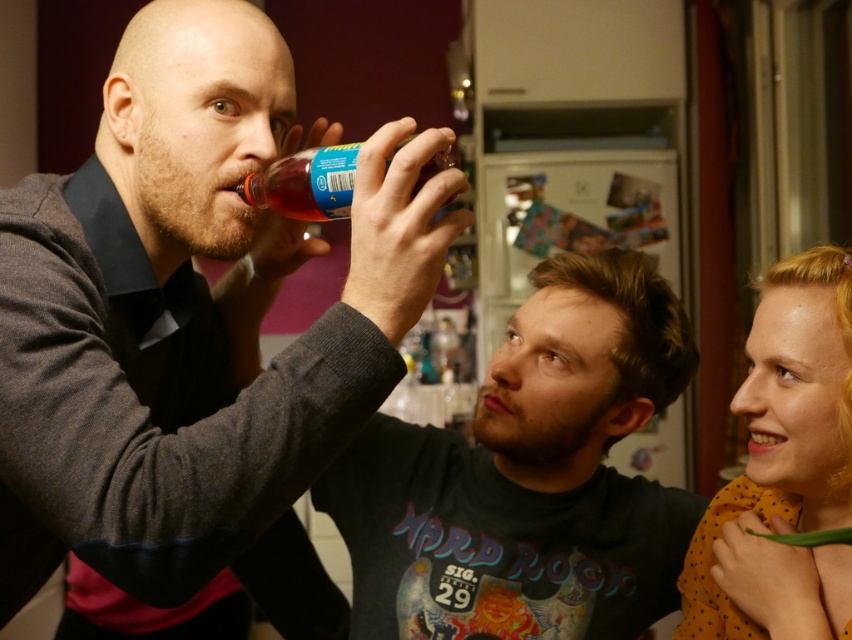
Question: Is polka dot fabric at right positioned at the back of translucent plastic bottle at upper center?

Choices:
 (A) no
 (B) yes

Answer: (B)

Question: Does polka dot fabric at right lie in front of translucent plastic bottle at upper center?

Choices:
 (A) no
 (B) yes

Answer: (A)

Question: Can you confirm if matte black bottle at upper left is wider than polka dot fabric at right?

Choices:
 (A) no
 (B) yes

Answer: (B)

Question: Which point is closer to the camera?

Choices:
 (A) (256, 200)
 (B) (755, 336)

Answer: (A)

Question: Which of the following is the closest to the observer?

Choices:
 (A) translucent plastic bottle at upper center
 (B) matte black bottle at upper left

Answer: (B)

Question: Which of the following is the closest to the observer?

Choices:
 (A) pyautogui.click(x=291, y=198)
 (B) pyautogui.click(x=424, y=148)
 (C) pyautogui.click(x=720, y=620)

Answer: (B)